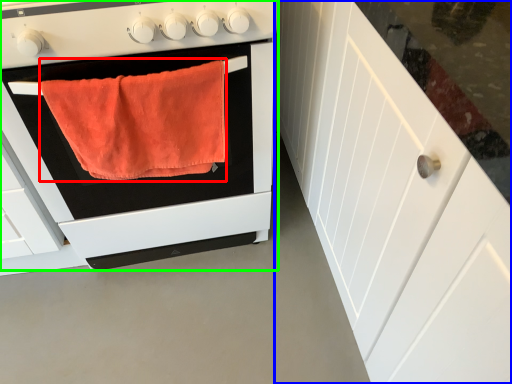
Question: Estimate the real-world distances between objects in this image. Which object is closer to bath towel (highlighted by a red box), cabinetry (highlighted by a blue box) or oven (highlighted by a green box)?

Choices:
 (A) cabinetry
 (B) oven

Answer: (B)